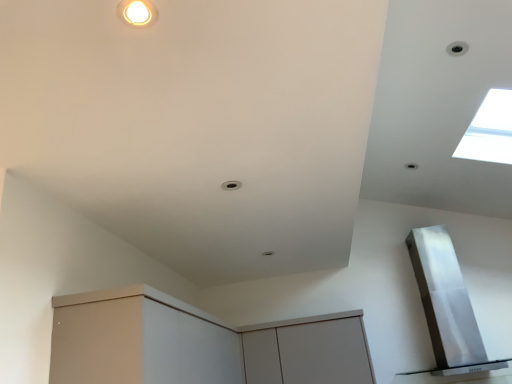
Question: Is matte white cabinet at lower left, acting as the 1th cabinetry starting from the left, bigger or smaller than transparent glass window at upper right?

Choices:
 (A) big
 (B) small

Answer: (A)

Question: Is matte white cabinet at lower left, acting as the 1th cabinetry starting from the left, in front of or behind transparent glass window at upper right in the image?

Choices:
 (A) front
 (B) behind

Answer: (A)

Question: Based on their relative distances, which object is farther from the satin silver exhaust hood at upper right?

Choices:
 (A) transparent glass window at upper right
 (B) matte gray cabinet at center, which is the second cabinetry in left-to-right order
 (C) matte white cabinet at lower left, marked as the second cabinetry in a right-to-left arrangement

Answer: (C)

Question: Estimate the real-world distances between objects in this image. Which object is closer to the satin silver exhaust hood at upper right?

Choices:
 (A) transparent glass window at upper right
 (B) matte gray cabinet at center, positioned as the 1th cabinetry in right-to-left order
 (C) matte white cabinet at lower left, acting as the 1th cabinetry starting from the left

Answer: (B)